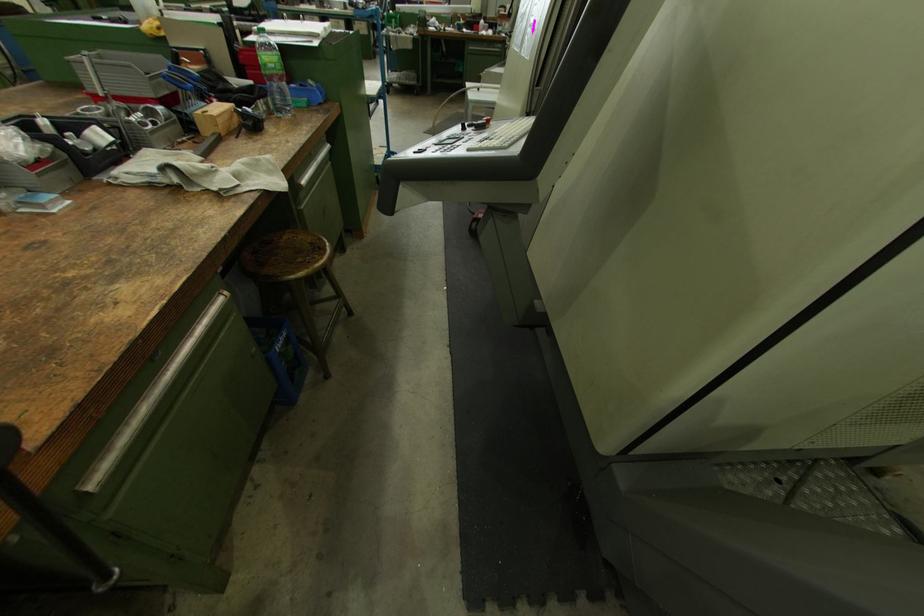
Where is `white control dial`? white control dial is located at coordinates (450, 139).